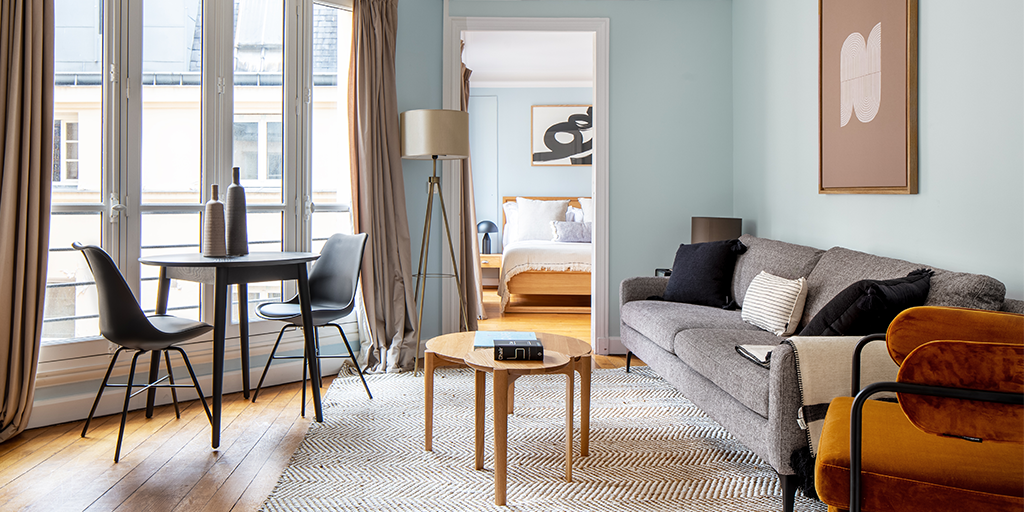
At what (x,y) coordinates should I click in order to perform the action: click on coffee table. Please return your answer as a coordinate pair (x, y). Looking at the image, I should click on (438, 344).